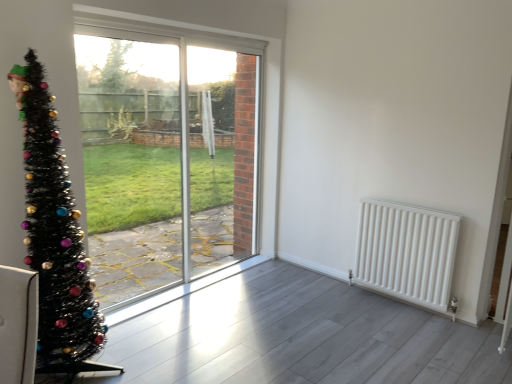
Find the location of a particular element. The height and width of the screenshot is (384, 512). vacant area on the back side of black tinsel christmas tree at left is located at coordinates (126, 335).